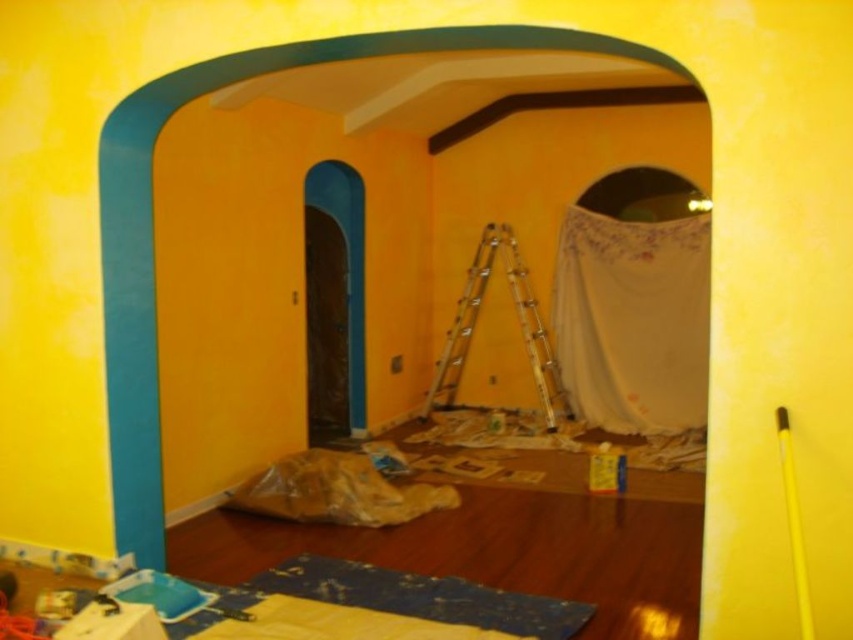
Which is in front, point (686, 308) or point (460, 301)?

Point (686, 308) is more forward.

Is point (613, 333) positioned before point (451, 356)?

Yes, it is.

Describe the element at coordinates (633, 321) in the screenshot. I see `white lace curtain at center` at that location.

Where is `white lace curtain at center`? This screenshot has height=640, width=853. white lace curtain at center is located at coordinates (633, 321).